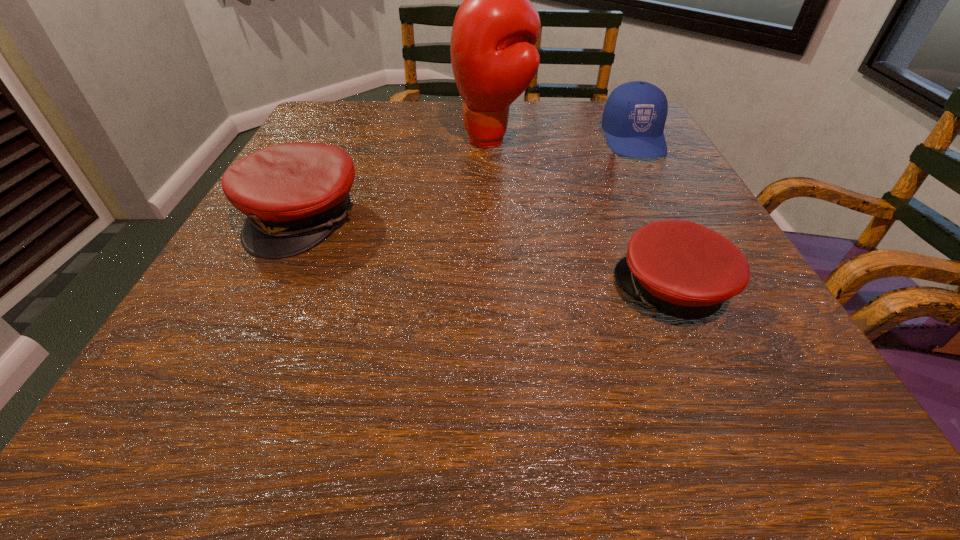
Where is `free spot between the farthest cap and the shortest cap`? free spot between the farthest cap and the shortest cap is located at coordinates (653, 215).

This screenshot has height=540, width=960. I want to click on vacant space that is in between the leftmost cap and the shortest cap, so click(489, 255).

I want to click on free point between the tallest object and the leftmost cap, so click(398, 179).

Image resolution: width=960 pixels, height=540 pixels. I want to click on empty location between the tallest object and the leftmost cap, so click(398, 179).

Identify which object is the second closest to the farthest cap. Please provide its 2D coordinates. Your answer should be formatted as a tuple, i.e. [(x, y)], where the tuple contains the x and y coordinates of a point satisfying the conditions above.

[(679, 268)]

I want to click on the closest object to the boxing glove, so click(x=634, y=116).

In order to click on cap that is the closest to the third object from right to left in this screenshot , I will do `click(634, 116)`.

The image size is (960, 540). Identify the location of cap that is the closest to the tallest object. (634, 116).

Locate an element on the screen. The image size is (960, 540). free location that satisfies the following two spatial constraints: 1. on the front-facing side of the farthest cap; 2. on the front-facing side of the shortest object is located at coordinates (713, 291).

The height and width of the screenshot is (540, 960). In order to click on vacant space that satisfies the following two spatial constraints: 1. on the front-facing side of the farthest cap; 2. on the striking surface of the boxing glove in this screenshot , I will do `click(634, 140)`.